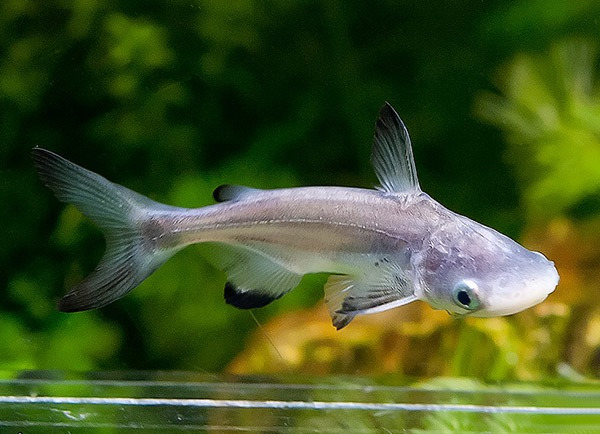
This screenshot has height=434, width=600. I want to click on scales, so click(341, 235).